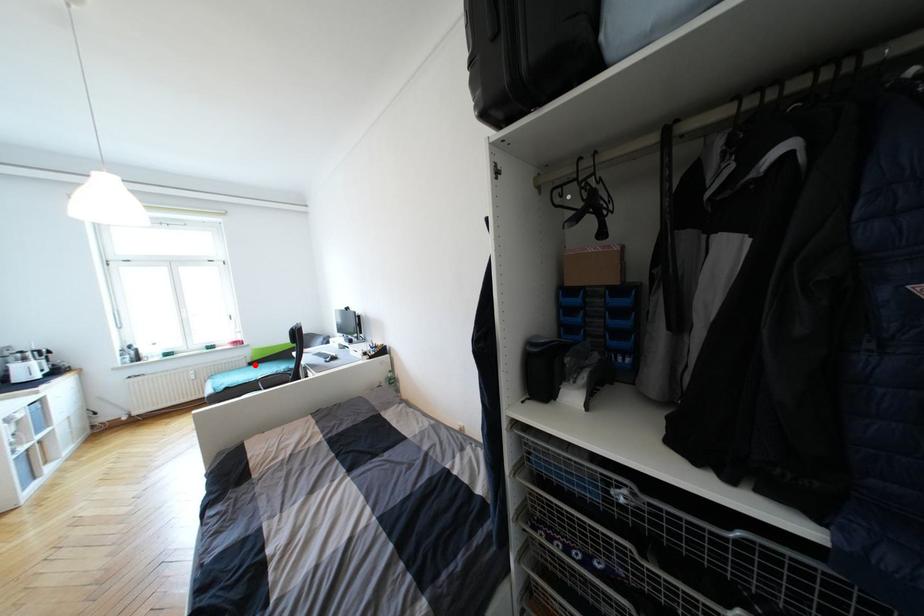
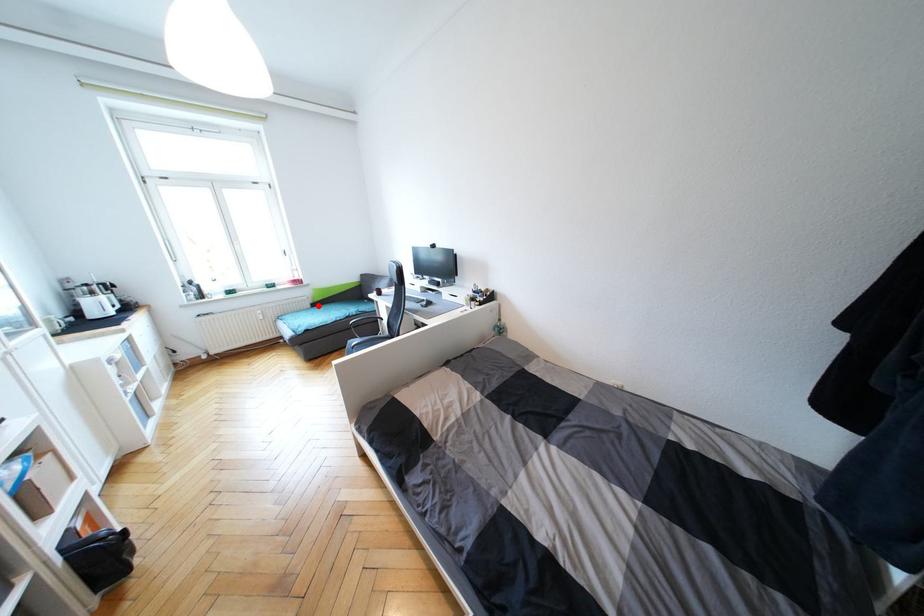
I am providing you with two images of the same scene from different viewpoints. A red point is marked on the first image and another point is marked on the second image. Is the red point in image1 aligned with the point shown in image2?

Yes